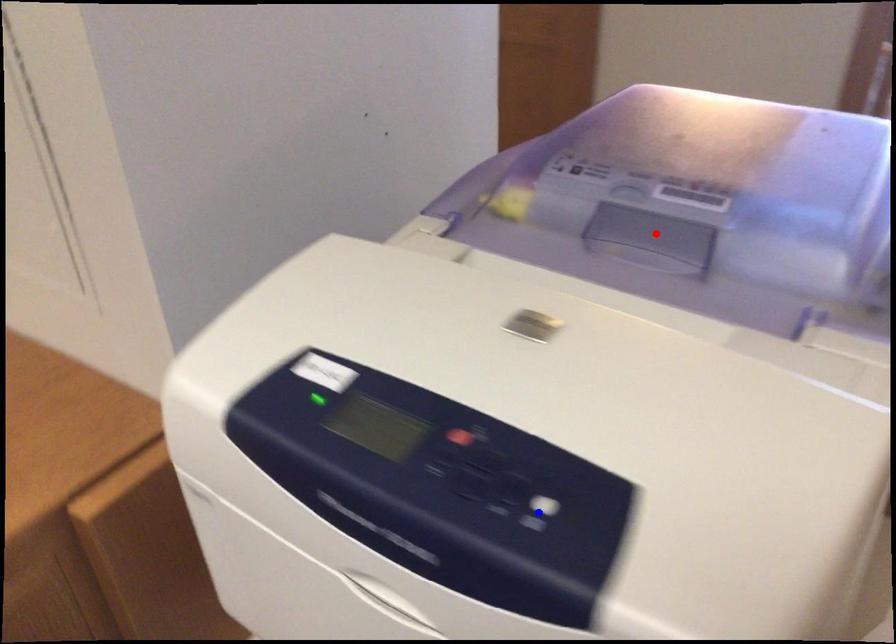
Question: Which of the two points in the image is closer to the camera?

Choices:
 (A) Blue point is closer.
 (B) Red point is closer.

Answer: (A)